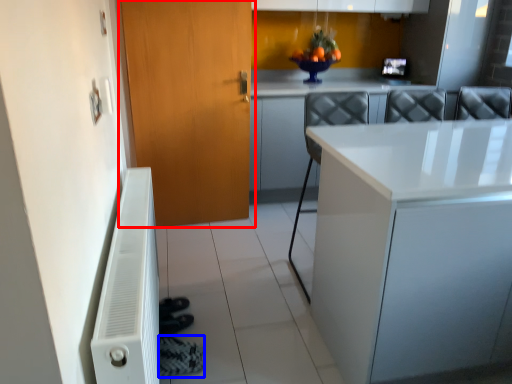
Question: Which object appears closest to the camera in this image, door (highlighted by a red box) or shoe (highlighted by a blue box)?

Choices:
 (A) door
 (B) shoe

Answer: (B)